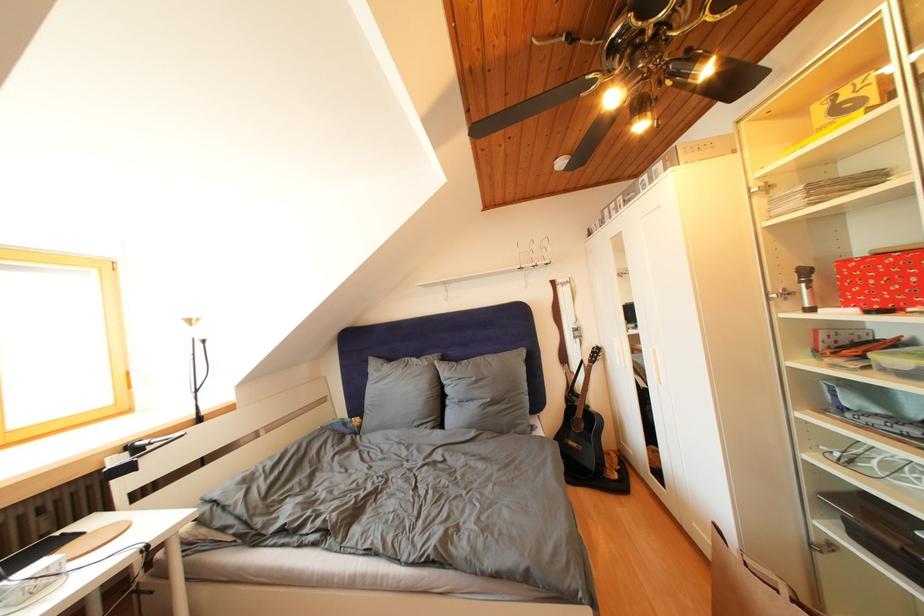
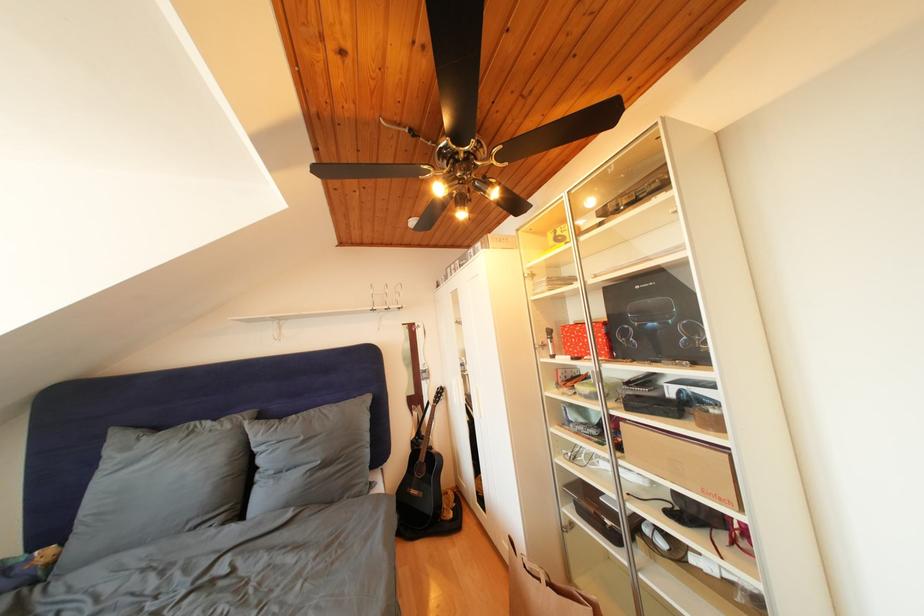
Locate, in the second image, the point that corresponds to the point at 574,403 in the first image.

(420, 447)